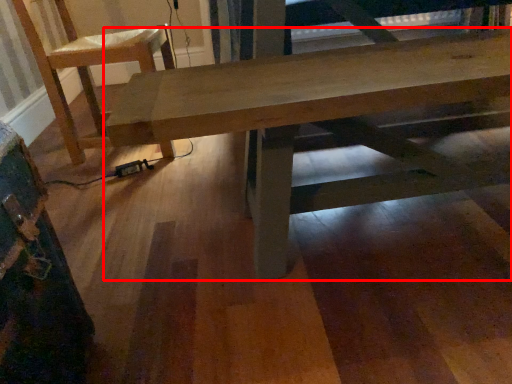
Question: From the image, what is the correct spatial relationship of table (annotated by the red box) in relation to chair?

Choices:
 (A) right
 (B) left

Answer: (A)